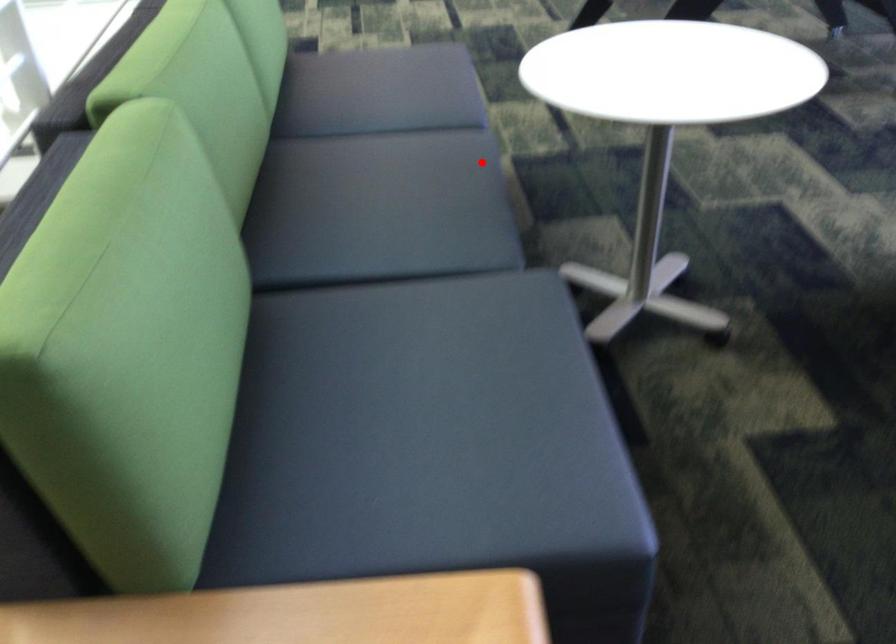
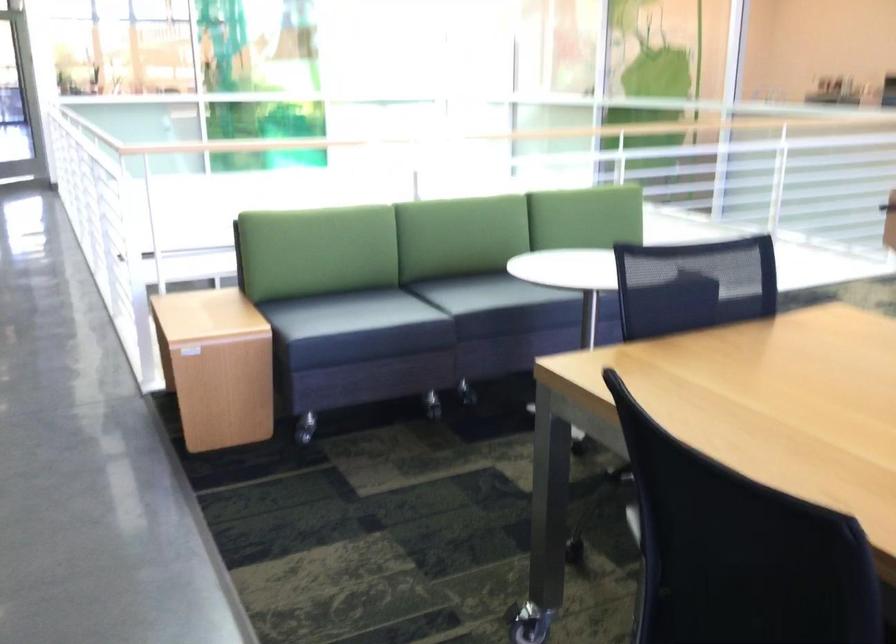
Question: A red point is marked in image1. In image2, is the corresponding 3D point closer to the camera or farther? Reply with the corresponding letter.

Choices:
 (A) The corresponding 3D point is closer.
 (B) The corresponding 3D point is farther.

Answer: (B)